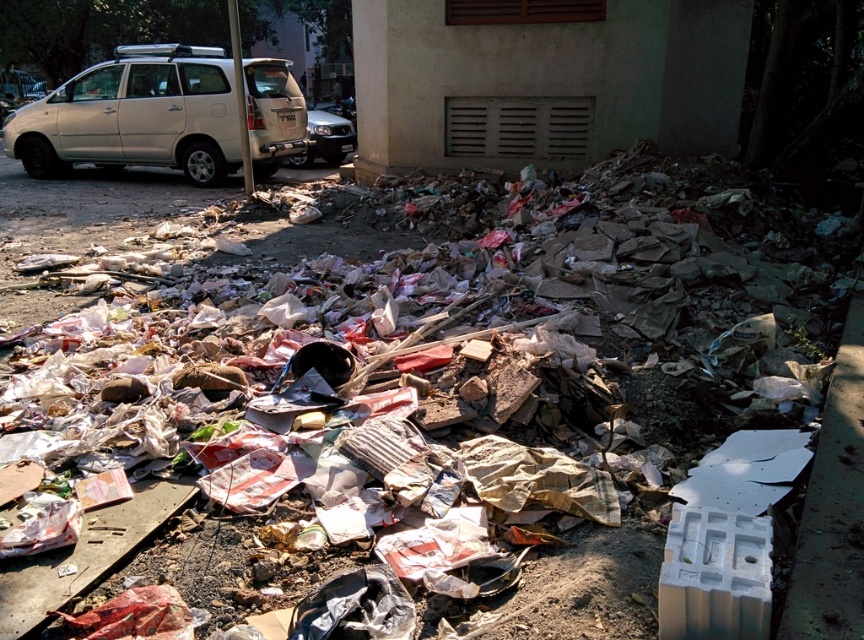
You are a delivery driver who needs to back up your silver metallic van at upper left to load more packages. The loading dock is behind the van. Can you safely back up the van without hitting the large pile of garbage in the foreground?

The silver metallic van at upper left is positioned at point 0.157 on the y axis, which is close to the bottom of the image. Since the large pile of garbage is in the foreground, it is likely blocking the path behind the van. Therefore, the driver cannot safely back up without hitting the garbage pile.

You are a delivery driver who needs to park your vehicle. You see a silver metallic van at upper left and a silver metallic suv at center. Which parking spot can accommodate your large truck if the suv is bigger than the van?

The silver metallic suv at center is larger than the silver metallic van at upper left, so the parking spot for the silver metallic suv at center can accommodate your large truck.

You are a delivery driver who needs to park your truck next to the silver metallic van at upper left and the silver metallic suv at center. Based on the available space, can you determine which vehicle you can park next to without overlapping?

The silver metallic van at upper left might be wider than silver metallic suv at center, so the suv at center would allow more space for parking next to it.